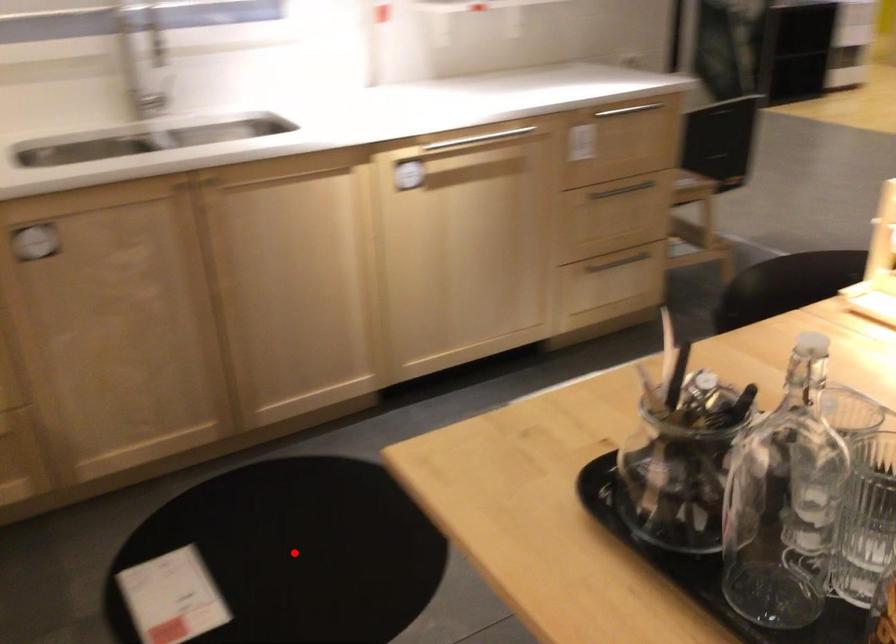
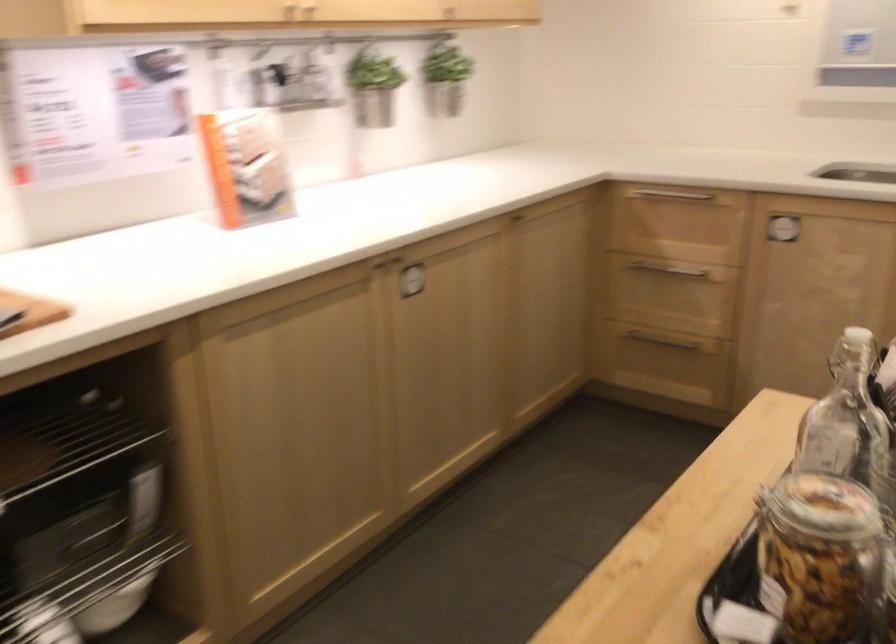
Question: I am providing you with two images of the same scene from different viewpoints. A red point is marked on the first image. At the location where the point appears in image 1, is it still visible in image 2?

Choices:
 (A) Yes
 (B) No

Answer: (B)